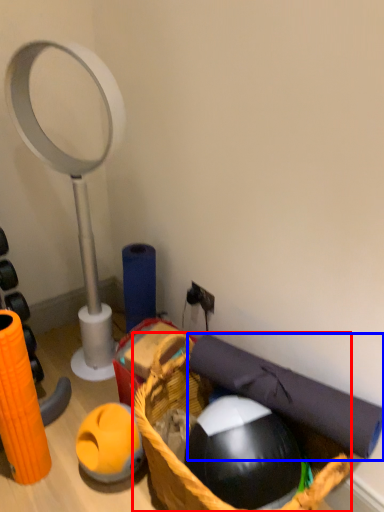
Question: Which object is further to the camera taking this photo, basket (highlighted by a red box) or yoga mat (highlighted by a blue box)?

Choices:
 (A) basket
 (B) yoga mat

Answer: (B)